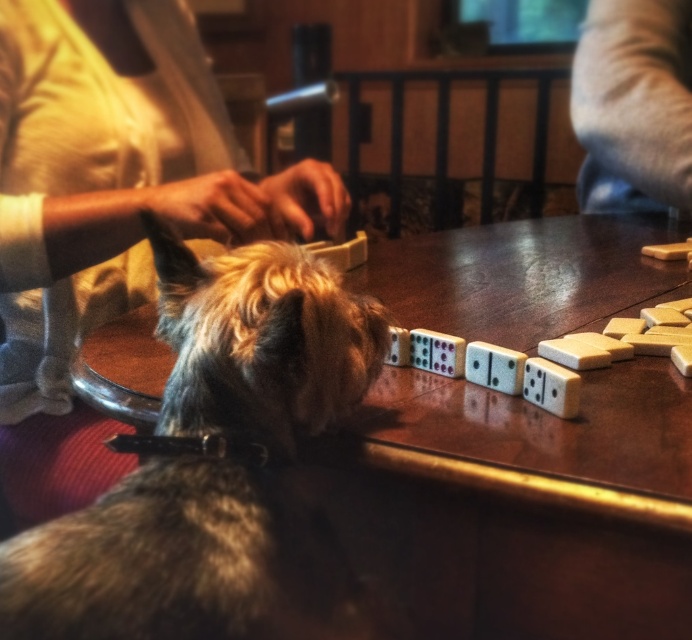
Question: Is fuzzy fur dog at lower left bigger than gray fabric at upper right?

Choices:
 (A) no
 (B) yes

Answer: (A)

Question: Among these objects, which one is farthest from the camera?

Choices:
 (A) fuzzy fur dog at lower left
 (B) gray fabric at upper right

Answer: (B)

Question: Which point appears closest to the camera in this image?

Choices:
 (A) (273, 545)
 (B) (592, 120)

Answer: (A)

Question: Can you confirm if fuzzy fur dog at lower left is positioned below gray fabric at upper right?

Choices:
 (A) yes
 (B) no

Answer: (A)

Question: Which point appears farthest from the camera in this image?

Choices:
 (A) (606, 52)
 (B) (257, 344)

Answer: (A)

Question: Can you confirm if fuzzy fur dog at lower left is positioned below gray fabric at upper right?

Choices:
 (A) yes
 (B) no

Answer: (A)